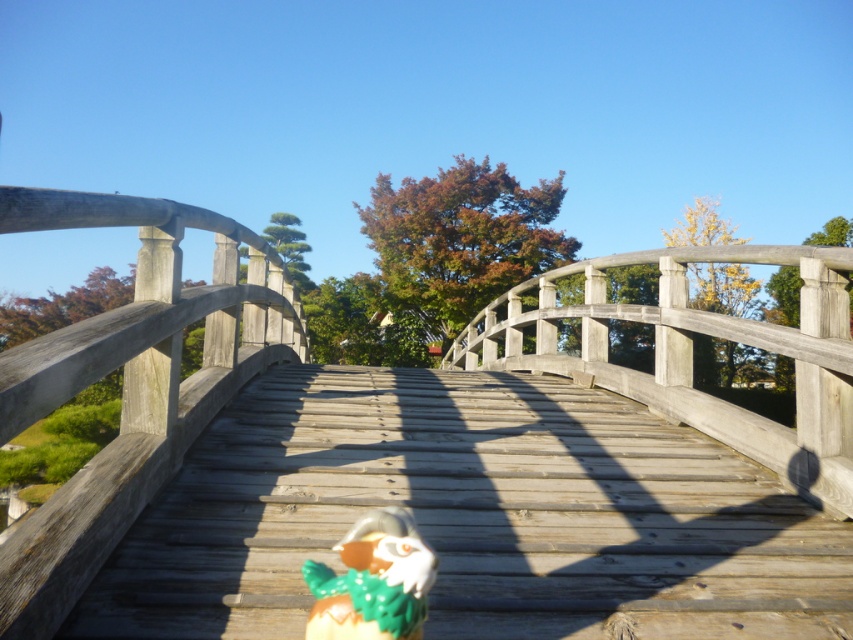
Is wooden bridge at center thinner than shiny metallic toy at center?

Indeed, wooden bridge at center has a lesser width compared to shiny metallic toy at center.

Image resolution: width=853 pixels, height=640 pixels. What do you see at coordinates (129, 384) in the screenshot? I see `wooden bridge at center` at bounding box center [129, 384].

Identify the location of wooden bridge at center. [129, 384].

You are a GUI agent. You are given a task and a screenshot of the screen. Output one action in this format:
    pyautogui.click(x=<x>, y=<y>)
    Task: Click on the wooden bridge at center
    
    Given the screenshot: What is the action you would take?
    pyautogui.click(x=129, y=384)